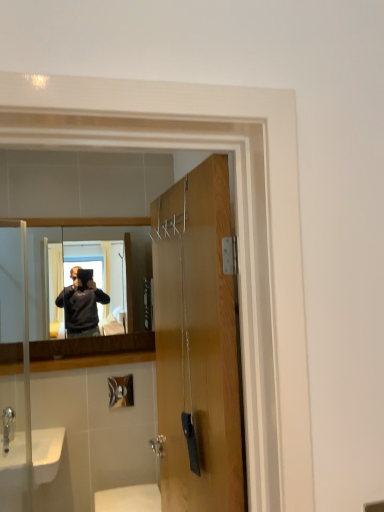
Question: From a real-world perspective, does matte wooden mirror at center stand above wooden door at center?

Choices:
 (A) no
 (B) yes

Answer: (B)

Question: Can you confirm if matte wooden mirror at center is bigger than wooden door at center?

Choices:
 (A) yes
 (B) no

Answer: (B)

Question: Could you tell me if matte wooden mirror at center is turned towards wooden door at center?

Choices:
 (A) yes
 (B) no

Answer: (A)

Question: Is matte wooden mirror at center positioned with its back to wooden door at center?

Choices:
 (A) no
 (B) yes

Answer: (A)

Question: Does matte wooden mirror at center have a greater height compared to wooden door at center?

Choices:
 (A) no
 (B) yes

Answer: (A)

Question: Considering the positions of point (11, 436) and point (125, 498), is point (11, 436) closer or farther from the camera than point (125, 498)?

Choices:
 (A) closer
 (B) farther

Answer: (A)

Question: From the image's perspective, is silver metallic faucet at lower left above or below white glossy toilet at lower center?

Choices:
 (A) below
 (B) above

Answer: (B)

Question: From a real-world perspective, is silver metallic faucet at lower left physically located above or below white glossy toilet at lower center?

Choices:
 (A) below
 (B) above

Answer: (B)

Question: In terms of height, does silver metallic faucet at lower left look taller or shorter compared to white glossy toilet at lower center?

Choices:
 (A) tall
 (B) short

Answer: (B)

Question: Relative to silver metallic faucet at lower left, is white glossy toilet at lower center in front or behind?

Choices:
 (A) front
 (B) behind

Answer: (A)

Question: Considering the positions of point (102, 493) and point (4, 449), is point (102, 493) closer or farther from the camera than point (4, 449)?

Choices:
 (A) closer
 (B) farther

Answer: (B)

Question: In the image, is white glossy toilet at lower center on the left side or the right side of silver metallic faucet at lower left?

Choices:
 (A) left
 (B) right

Answer: (B)

Question: Do you think white glossy toilet at lower center is within silver metallic faucet at lower left, or outside of it?

Choices:
 (A) inside
 (B) outside

Answer: (B)

Question: Is point click(9, 234) positioned closer to the camera than point click(8, 415)?

Choices:
 (A) farther
 (B) closer

Answer: (A)

Question: Considering the positions of matte wooden mirror at center and silver metallic faucet at lower left in the image, is matte wooden mirror at center wider or thinner than silver metallic faucet at lower left?

Choices:
 (A) thin
 (B) wide

Answer: (A)